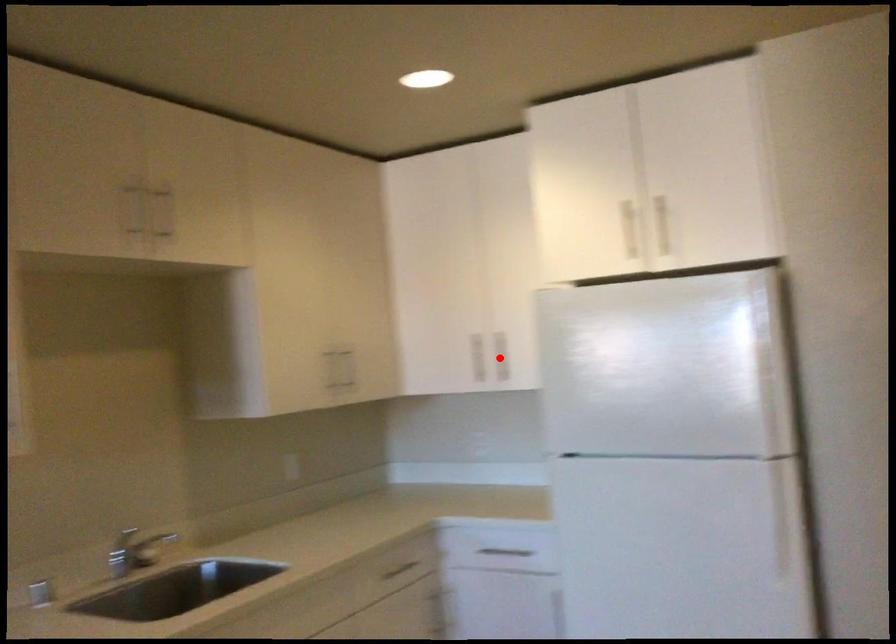
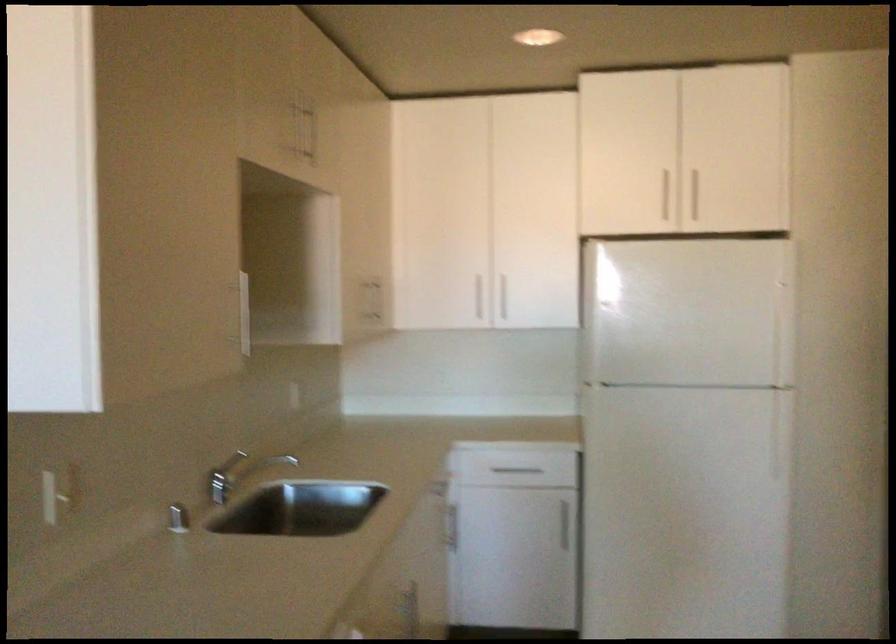
Question: I am providing you with two images of the same scene from different viewpoints. A red point is marked on the first image. At the location where the point appears in image 1, is it still visible in image 2?

Choices:
 (A) Yes
 (B) No

Answer: (A)